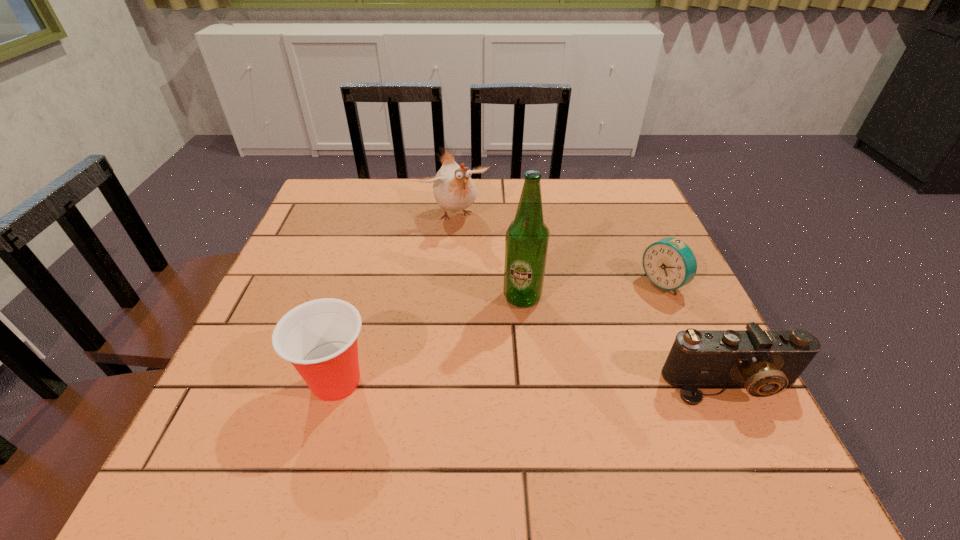
Identify the location of free spot at the far left corner of the desktop. Image resolution: width=960 pixels, height=540 pixels. coord(340,183).

This screenshot has width=960, height=540. What are the coordinates of `free space at the near left corner` in the screenshot? It's located at (239, 411).

Find the location of a particular element. free space at the far right corner of the desktop is located at coordinates (634, 221).

Identify the location of vacant point at the near right corner. (737, 395).

Locate an element on the screen. The image size is (960, 540). free space that is in between the alarm clock and the beer bottle is located at coordinates coord(592,291).

Identify the location of vacant point located between the third object from left to right and the cup. Image resolution: width=960 pixels, height=540 pixels. (429, 339).

Where is `empty space that is in between the third tallest object and the second tallest object`? This screenshot has height=540, width=960. empty space that is in between the third tallest object and the second tallest object is located at coordinates [396, 299].

Locate an element on the screen. The width and height of the screenshot is (960, 540). vacant area that lies between the fourth shortest object and the camera is located at coordinates (592, 300).

This screenshot has height=540, width=960. Find the location of `free space between the third object from right to left and the leftmost object`. free space between the third object from right to left and the leftmost object is located at coordinates (429, 339).

Locate an element on the screen. Image resolution: width=960 pixels, height=540 pixels. blank region between the second tallest object and the camera is located at coordinates (592, 300).